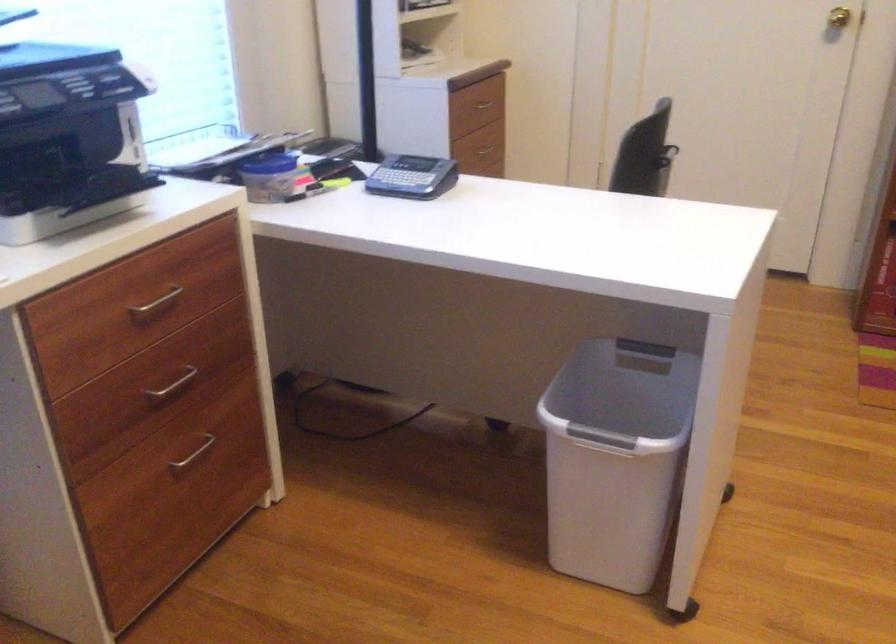
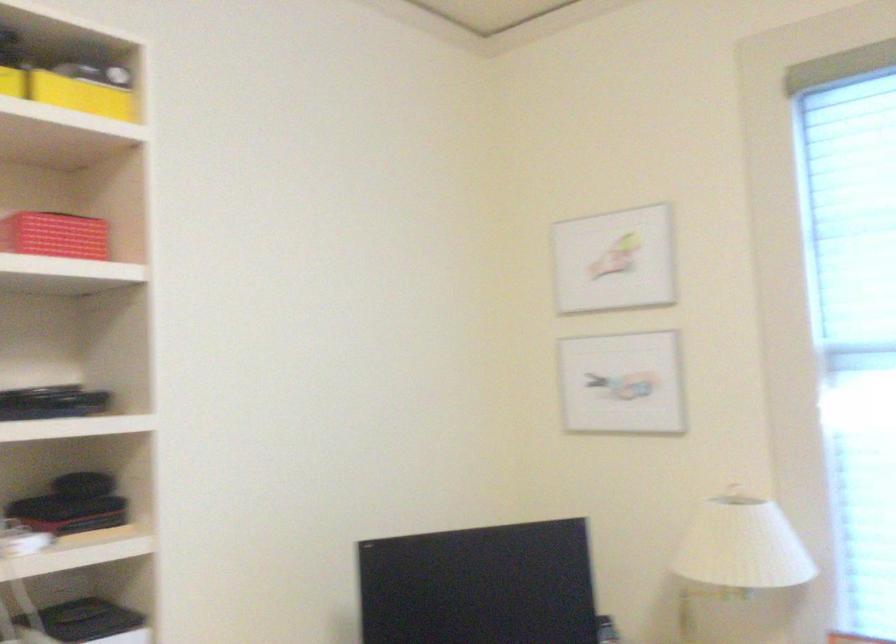
Question: The camera is either moving clockwise (left) or counter-clockwise (right) around the object. The first image is from the beginning of the video and the second image is from the end. Is the camera moving left or right when shooting the video?

Choices:
 (A) Left
 (B) Right

Answer: (B)